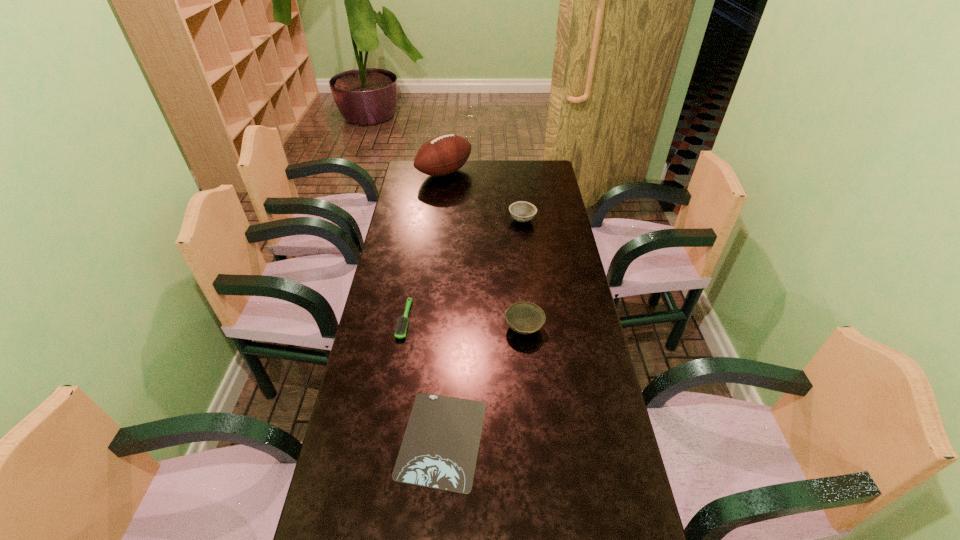
Find the location of `empty space between the nearer bowl and the hairbrush`. empty space between the nearer bowl and the hairbrush is located at coordinates (464, 324).

At what (x,y) coordinates should I click in order to perform the action: click on vacant space in between the hairbrush and the farther bowl. Please return your answer as a coordinate pair (x, y). Looking at the image, I should click on (464, 270).

Image resolution: width=960 pixels, height=540 pixels. What are the coordinates of `empty location between the fourth nearest object and the hairbrush` in the screenshot? It's located at (464, 270).

I want to click on vacant point located between the fourth tallest object and the shortest object, so click(423, 380).

This screenshot has height=540, width=960. I want to click on free spot between the hairbrush and the farther bowl, so click(x=464, y=270).

The image size is (960, 540). In order to click on blank region between the shortest object and the second shortest object in this screenshot , I will do `click(423, 380)`.

Identify the location of unoccupied area between the farther bowl and the hairbrush. The image size is (960, 540). (464, 270).

The image size is (960, 540). I want to click on vacant area between the farther bowl and the farthest object, so click(484, 197).

This screenshot has height=540, width=960. I want to click on vacant space in between the shortest object and the hairbrush, so click(423, 380).

Locate an element on the screen. This screenshot has width=960, height=540. vacant region between the nearer bowl and the fourth nearest object is located at coordinates (523, 274).